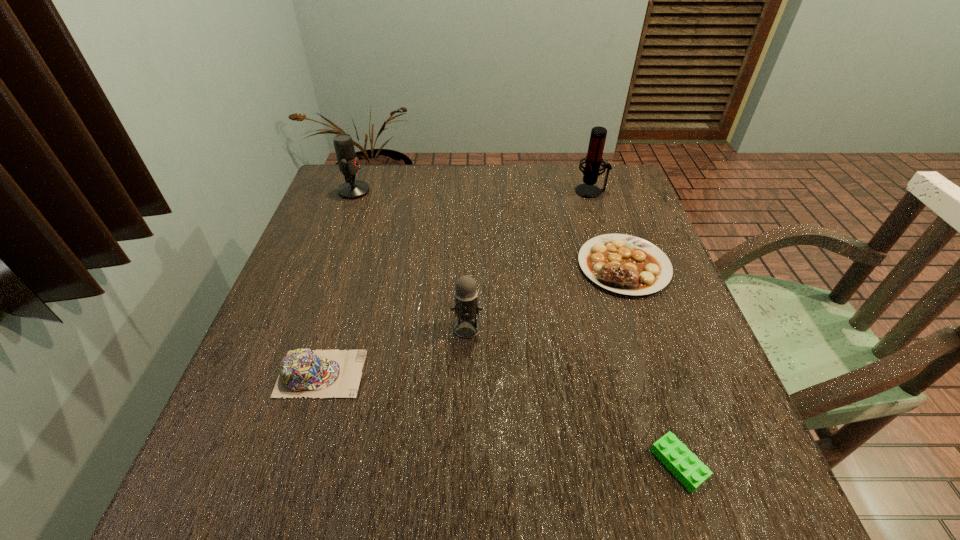
The image size is (960, 540). In order to click on vacant space located on the left of the rightmost microphone in this screenshot , I will do `click(450, 191)`.

Where is `free point located on the side of the leftmost microphone with the red ring`? The image size is (960, 540). free point located on the side of the leftmost microphone with the red ring is located at coordinates (468, 191).

The width and height of the screenshot is (960, 540). Identify the location of free space located 0.100m on the right of the second microphone from left to right. (530, 328).

Identify the location of free space located on the front, side, and top of the second nearest object. The width and height of the screenshot is (960, 540). (389, 374).

Find the location of a particular element. Image resolution: width=960 pixels, height=540 pixels. free space located on the left of the second shortest object is located at coordinates (545, 266).

Identify the location of vacant space situated on the back of the Lego. The image size is (960, 540). [634, 325].

Find the location of a particular element. This screenshot has width=960, height=540. object that is positioned at the near edge is located at coordinates (680, 461).

In order to click on microphone present at the left edge in this screenshot , I will do `click(348, 164)`.

Find the location of a particular element. cap at the left edge is located at coordinates (303, 372).

Locate an element on the screen. microphone present at the right edge is located at coordinates (593, 160).